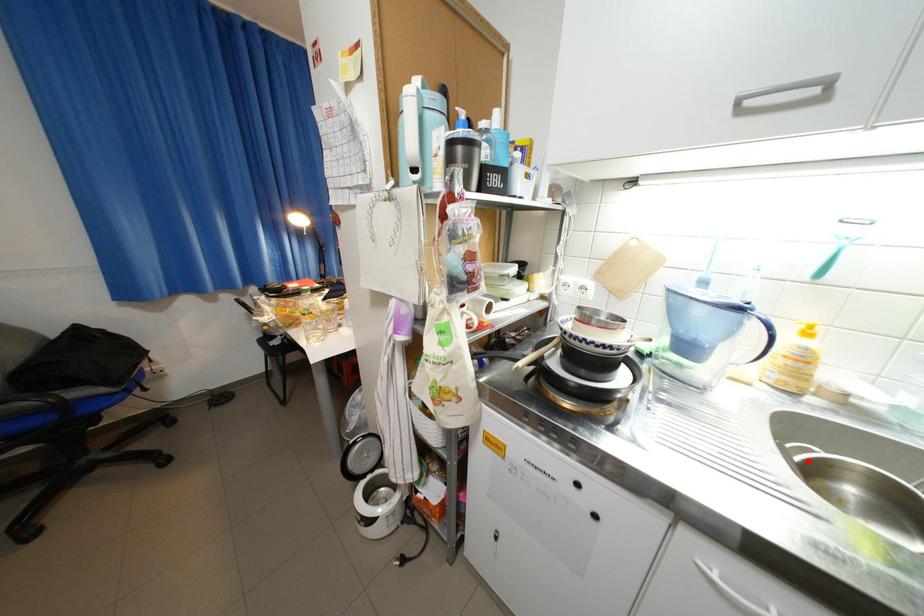
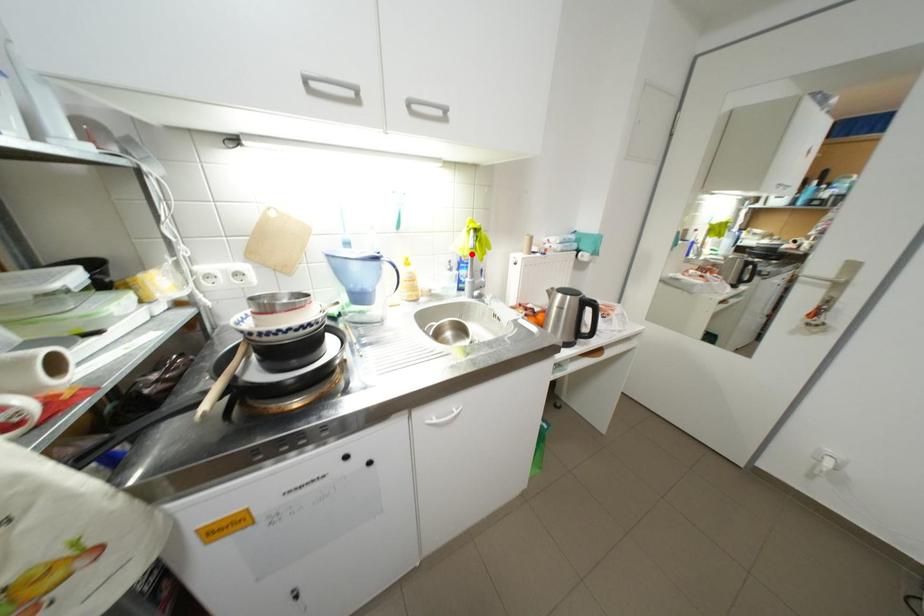
I am providing you with two images of the same scene from different viewpoints. A red point is marked on the first image and another point is marked on the second image. Are the points marked in image1 and image2 representing the same 3D position?

No